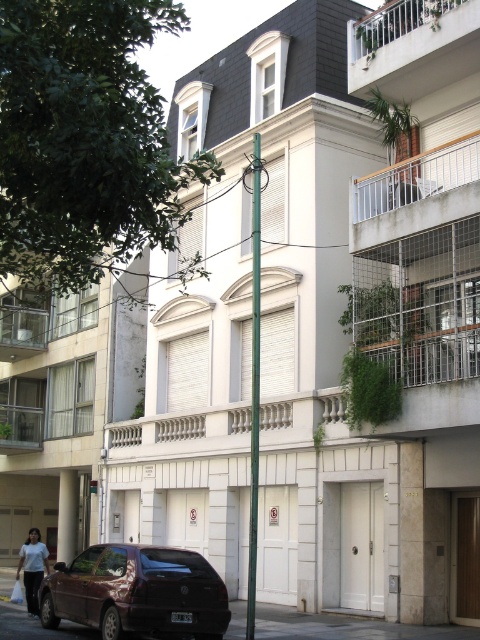
At what (x,y) coordinates should I click in order to perform the action: click on shiny maroon hatchback at lower left. Please return your answer as a coordinate pair (x, y). Looking at the image, I should click on (136, 593).

Which of these two, shiny maroon hatchback at lower left or white metal railing at upper right, stands shorter?

Standing shorter between the two is shiny maroon hatchback at lower left.

Is point (180, 579) closer to viewer compared to point (459, 186)?

Yes, it is.

Identify the location of shiny maroon hatchback at lower left. The image size is (480, 640). (136, 593).

Based on the photo, which of these two, white metal railing at upper center or white cotton shirt at lower left, stands taller?

white cotton shirt at lower left is taller.

Consider the image. Who is more distant from viewer, (354, 35) or (29, 536)?

The point (29, 536) is more distant.

This screenshot has height=640, width=480. I want to click on white metal railing at upper center, so click(412, 49).

Is shiny maroon hatchback at lower left closer to camera compared to white metal railing at upper center?

Yes, shiny maroon hatchback at lower left is closer to the viewer.

In the scene shown: Does shiny maroon hatchback at lower left have a lesser width compared to white metal railing at upper center?

No.

Who is more forward, [134,630] or [427,65]?

Positioned in front is point [134,630].

I want to click on shiny maroon hatchback at lower left, so click(x=136, y=593).